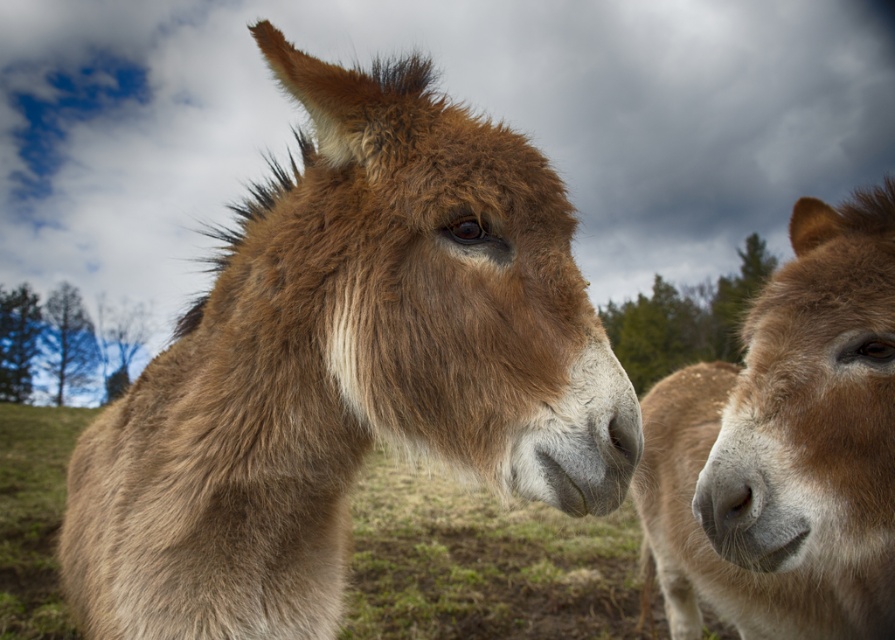
Between brown fuzzy donkey at center and brown fuzzy nose at center, which one has less height?

With less height is brown fuzzy nose at center.

Is brown fuzzy donkey at center to the right of brown fuzzy nose at center from the viewer's perspective?

In fact, brown fuzzy donkey at center is to the left of brown fuzzy nose at center.

Where is `brown fuzzy donkey at center`? brown fuzzy donkey at center is located at coordinates (344, 365).

Can you confirm if brown fuzzy donkey at right is wider than brown fuzzy nose at center?

Correct, the width of brown fuzzy donkey at right exceeds that of brown fuzzy nose at center.

From the picture: Can you confirm if brown fuzzy donkey at right is shorter than brown fuzzy nose at center?

No, brown fuzzy donkey at right is not shorter than brown fuzzy nose at center.

This screenshot has width=895, height=640. Describe the element at coordinates (786, 445) in the screenshot. I see `brown fuzzy donkey at right` at that location.

You are a GUI agent. You are given a task and a screenshot of the screen. Output one action in this format:
    pyautogui.click(x=<x>, y=<y>)
    Task: Click on the brown fuzzy donkey at right
    
    Given the screenshot: What is the action you would take?
    (x=786, y=445)

Between point (465, 131) and point (833, 529), which one is positioned behind?

Positioned behind is point (833, 529).

Which is more to the left, brown fuzzy donkey at center or brown fuzzy donkey at right?

brown fuzzy donkey at center

Measure the distance between point [284,429] and camera.

Point [284,429] is 1.37 meters away from camera.

Locate an element on the screen. brown fuzzy donkey at center is located at coordinates (344, 365).